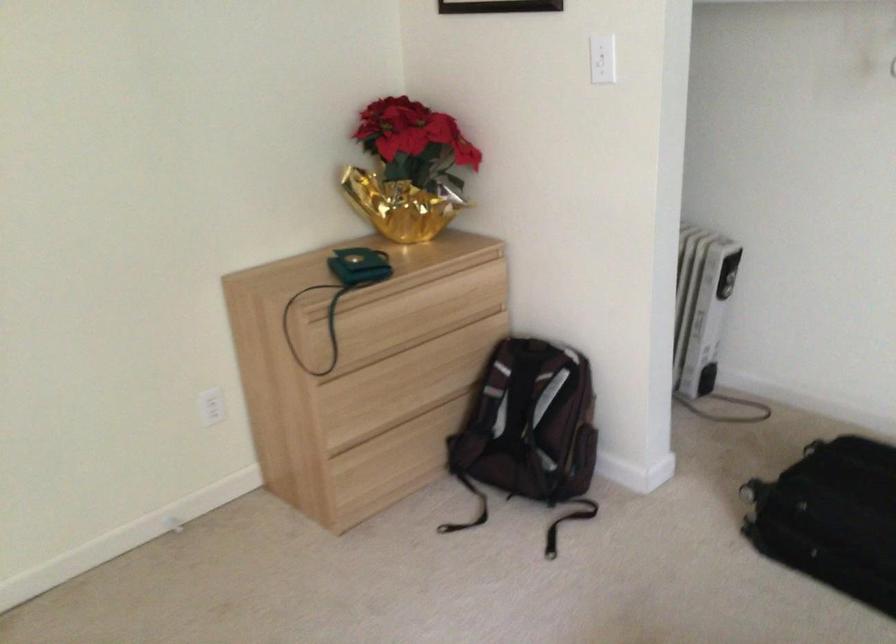
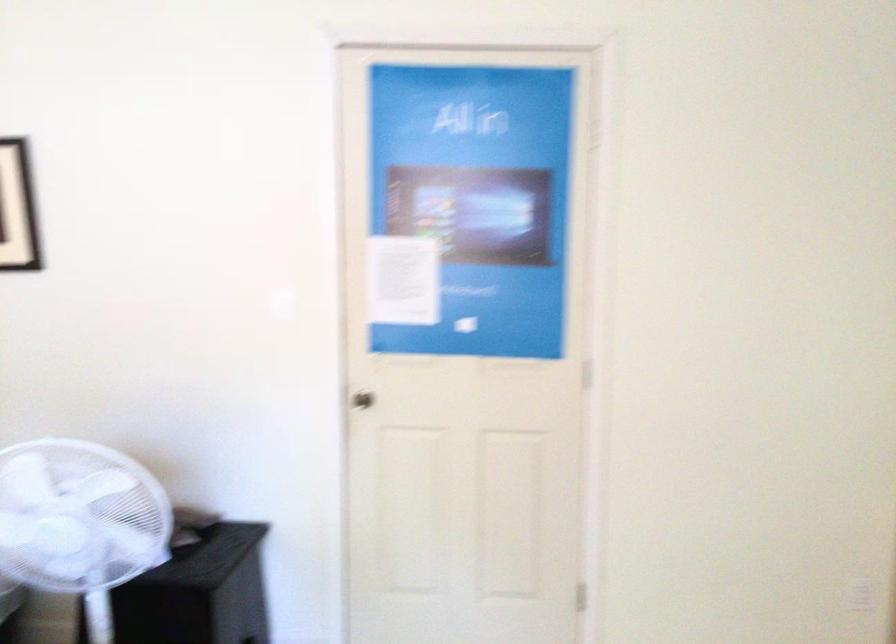
Question: The first image is from the beginning of the video and the second image is from the end. How did the camera likely rotate when shooting the video?

Choices:
 (A) Left
 (B) Right
 (C) Up
 (D) Down

Answer: (A)